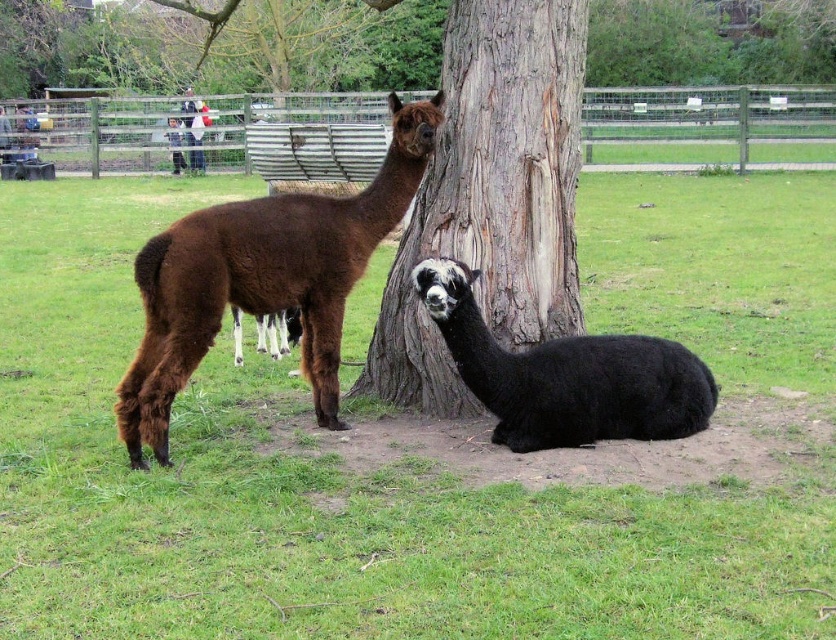
You are standing in front of the alpacas and want to place a small treat between the two points marked as point (523,200) and point (196,99). Which point is closer to you where you should place the treat?

Point (523,200) is closer to the viewer than point (196,99), so you should place the treat at point (523,200).

You are a zookeeper observing the brown woolly alpaca at left and the black woolly alpaca at lower center. Which alpaca is positioned higher in the image?

The brown woolly alpaca at left is positioned higher in the image than the black woolly alpaca at lower center.

You are a zookeeper who needs to check the height of the brown rough bark at center and the black woolly alpaca at lower center. Which one is taller?

The brown rough bark at center is taller than the black woolly alpaca at lower center.